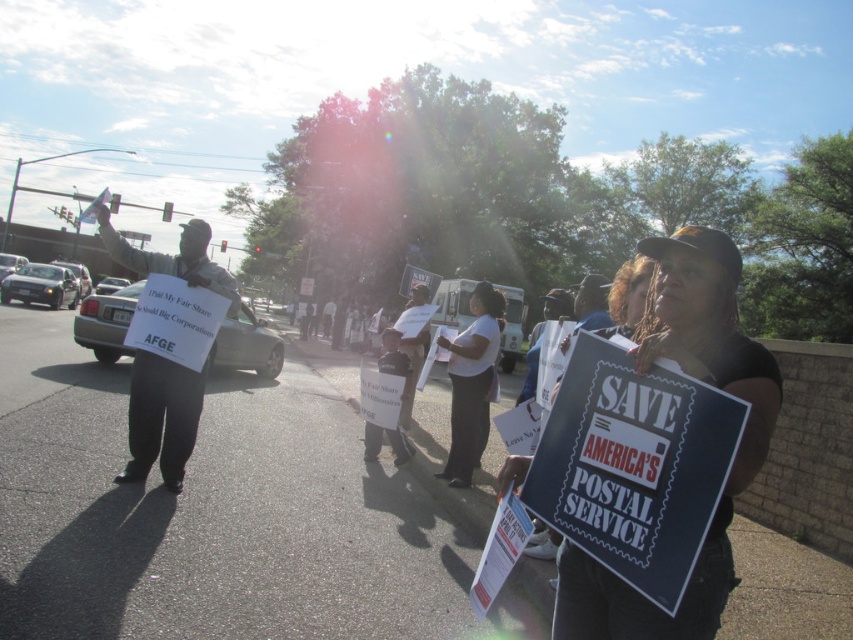
Who is lower down, black fabric sign at center or white cotton shirt at center?

Positioned lower is white cotton shirt at center.

Consider the image. Who is positioned more to the right, black fabric sign at center or white cotton shirt at center?

Positioned to the right is black fabric sign at center.

You are a GUI agent. You are given a task and a screenshot of the screen. Output one action in this format:
    pyautogui.click(x=<x>, y=<y>)
    Task: Click on the black fabric sign at center
    The height and width of the screenshot is (640, 853).
    Given the screenshot: What is the action you would take?
    click(x=732, y=461)

What are the coordinates of `black fabric sign at center` in the screenshot? It's located at (732, 461).